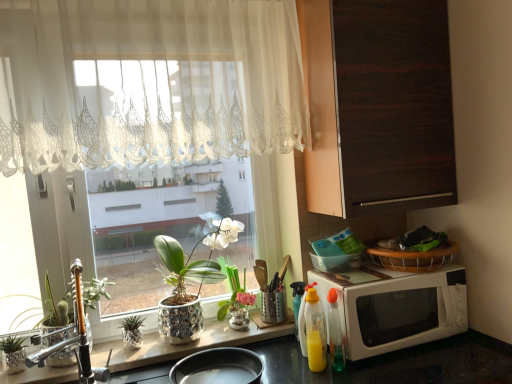
I want to click on vacant space underneath silver textured pot at center, the 2th houseplant viewed from the right (from a real-world perspective), so click(203, 339).